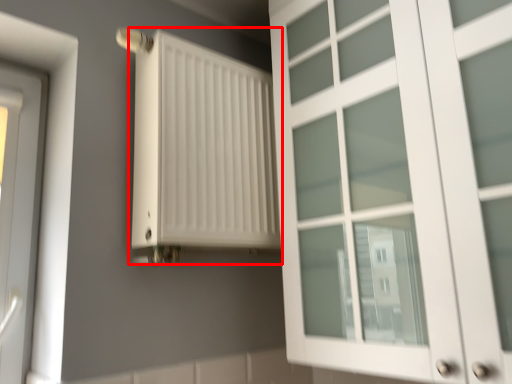
Question: Where is radiator (annotated by the red box) located in relation to cupboard in the image?

Choices:
 (A) left
 (B) right

Answer: (A)